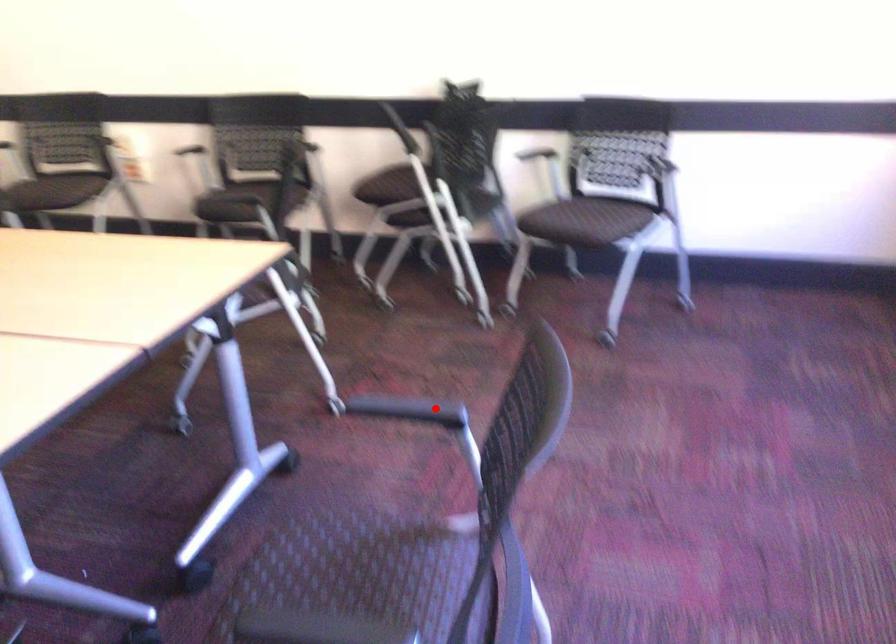
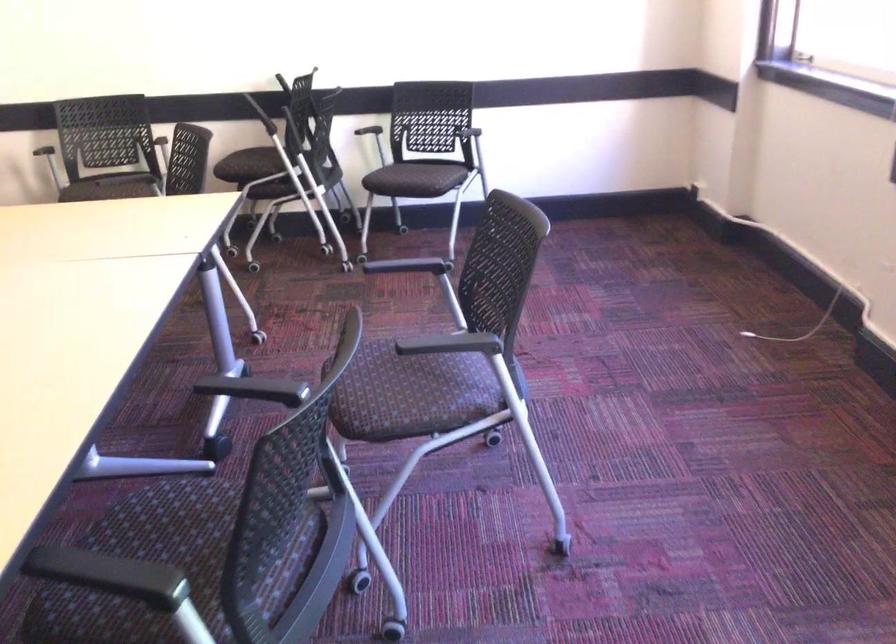
Find the pixel in the second image that matches the highlighted location in the first image.

(414, 268)